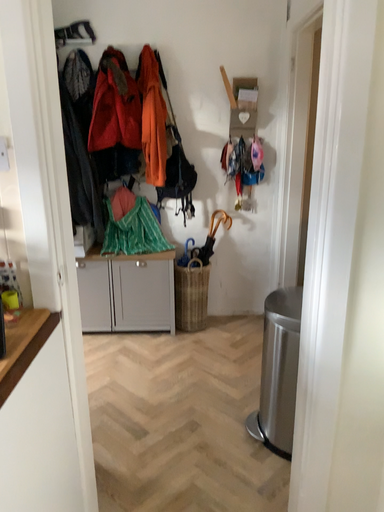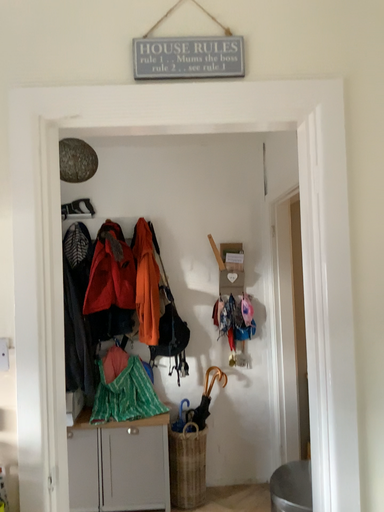
Question: How did the camera likely rotate when shooting the video?

Choices:
 (A) rotated upward
 (B) rotated downward

Answer: (A)